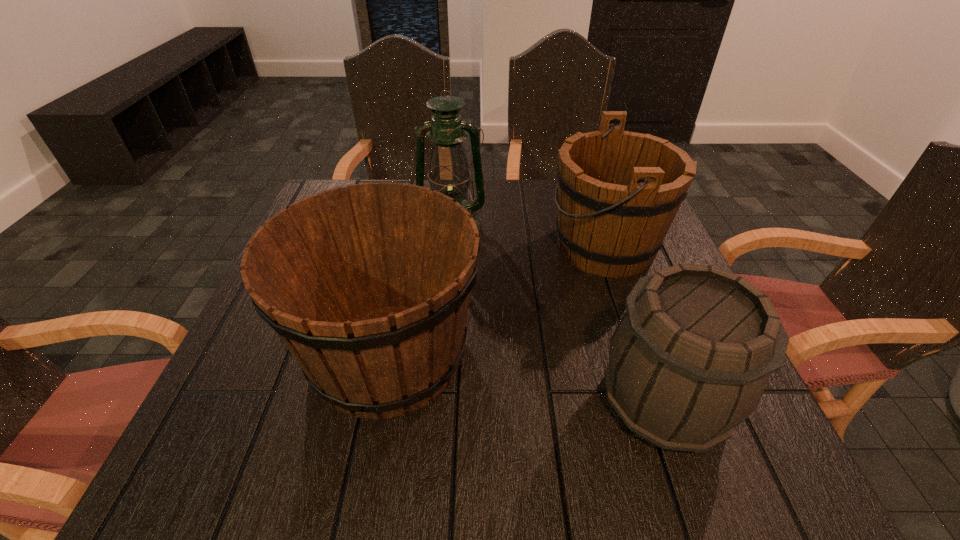
I want to click on free spot between the farthest wine bucket and the leftmost wine bucket, so click(496, 300).

I want to click on empty space that is in between the oil lamp and the farthest wine bucket, so click(529, 235).

This screenshot has width=960, height=540. I want to click on free space between the leftmost wine bucket and the farthest wine bucket, so click(496, 300).

I want to click on vacant region between the farthest wine bucket and the tallest object, so click(x=529, y=235).

This screenshot has width=960, height=540. In order to click on vacant area between the leftmost wine bucket and the farthest wine bucket in this screenshot , I will do `click(496, 300)`.

This screenshot has width=960, height=540. Identify the location of free spot between the farthest wine bucket and the leftmost wine bucket. (496, 300).

Locate an element on the screen. This screenshot has width=960, height=540. object that stands as the second closest to the tallest object is located at coordinates (368, 286).

Select which object is the second closest to the farthest wine bucket. Please provide its 2D coordinates. Your answer should be formatted as a tuple, i.e. [(x, y)], where the tuple contains the x and y coordinates of a point satisfying the conditions above.

[(368, 286)]

Locate which wine bucket ranks second in proximity to the tallest object. Please provide its 2D coordinates. Your answer should be formatted as a tuple, i.e. [(x, y)], where the tuple contains the x and y coordinates of a point satisfying the conditions above.

[(368, 286)]

Locate which wine bucket ranks second in proximity to the tallest object. Please provide its 2D coordinates. Your answer should be formatted as a tuple, i.e. [(x, y)], where the tuple contains the x and y coordinates of a point satisfying the conditions above.

[(368, 286)]